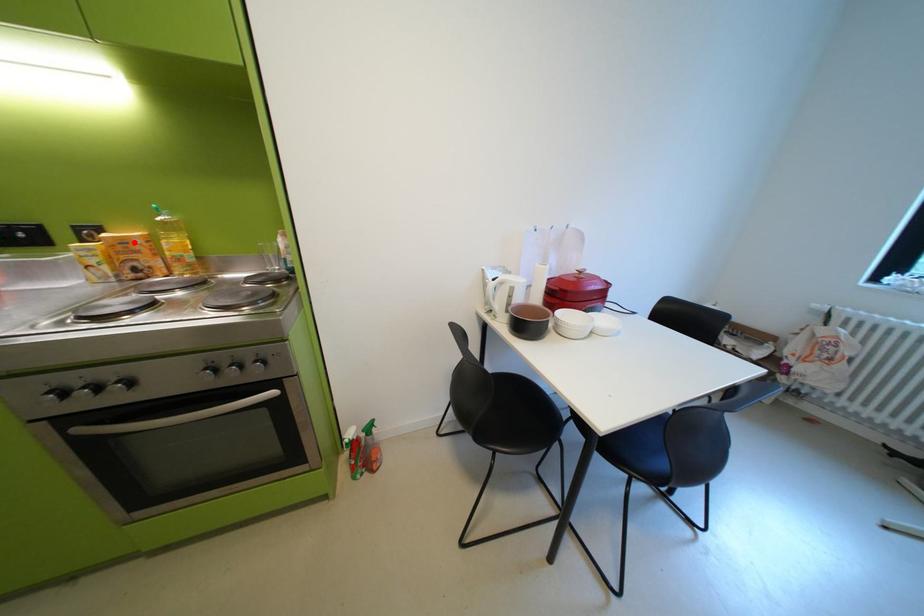
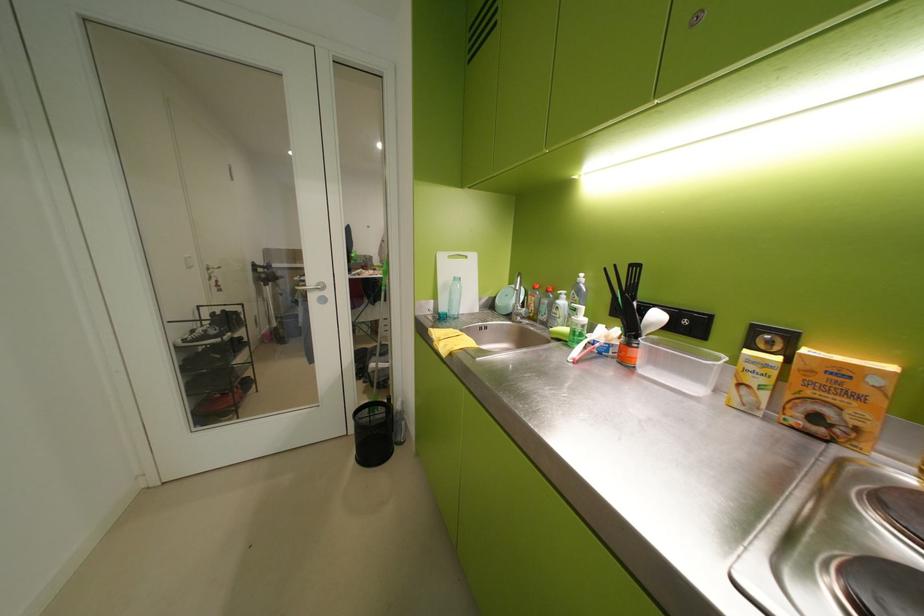
In the second image, find the point that corresponds to the highlighted location in the first image.

(852, 373)